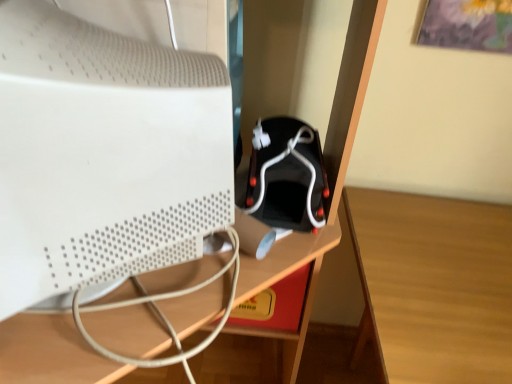
This screenshot has height=384, width=512. Describe the element at coordinates (286, 176) in the screenshot. I see `black matte speaker at center` at that location.

Locate an element on the screen. The width and height of the screenshot is (512, 384). black matte speaker at center is located at coordinates pyautogui.click(x=286, y=176).

This screenshot has width=512, height=384. I want to click on black matte speaker at center, so coord(286,176).